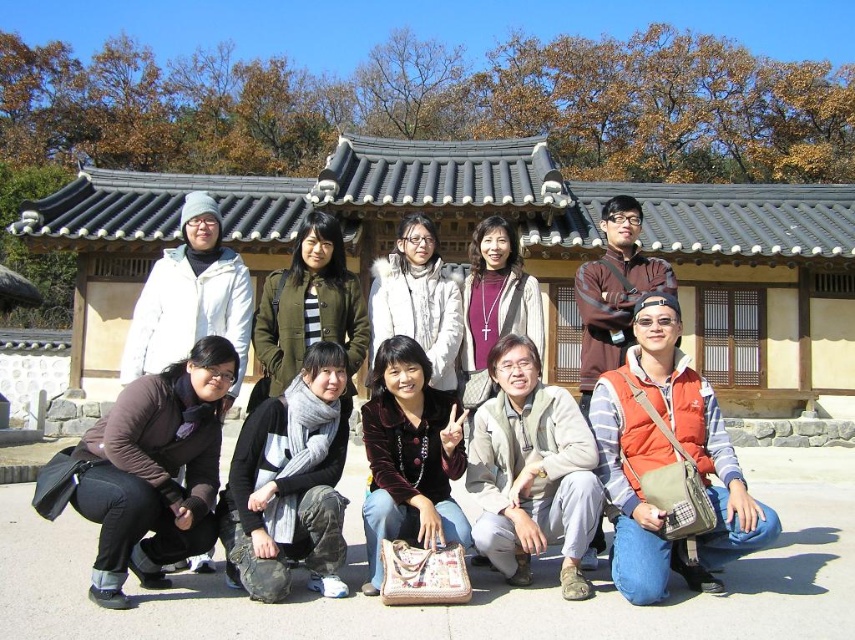
You are a photographer standing 10 feet away from the beige fabric jacket at lower center and velvet brown jacket at lower center. You want to take a photo that includes both jackets in the frame. Given that your camera has a maximum focal length that allows capturing objects within a 10 feet range, will both jackets be in the frame?

The distance between the beige fabric jacket at lower center and velvet brown jacket at lower center is 5.30 feet. Since the photographer is 10 feet away from both jackets and the camera can capture within a 10 feet range, both jackets will be within the frame as their separation is less than the maximum range.

You are a photographer trying to adjust the lighting for a group photo. You notice the orange fabric vest at lower right and the beige fabric jacket at lower center. Which of these two items is positioned more to the east in the image?

The orange fabric vest at lower right is to the right of beige fabric jacket at lower center, so it is positioned more to the east.